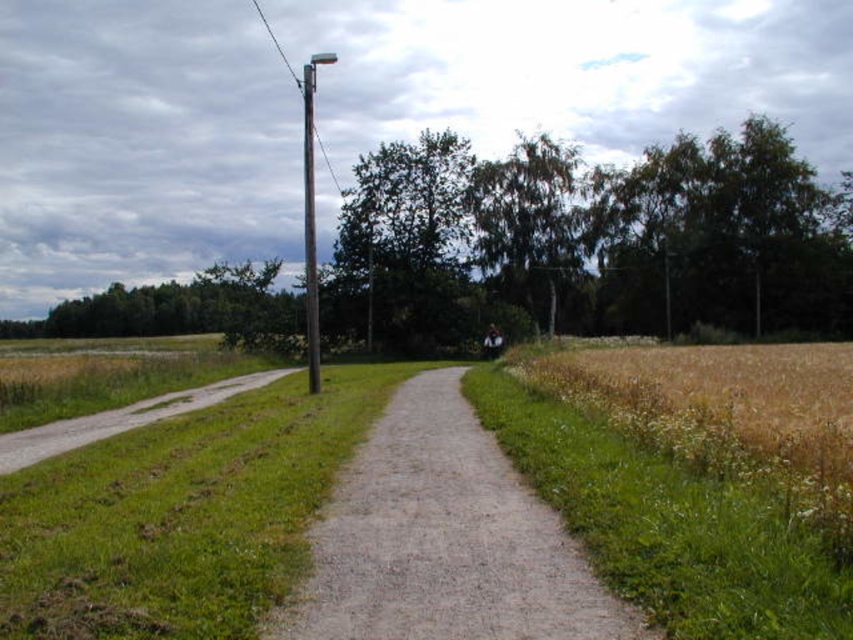
Question: Which object is the closest to the brown wooden telegraph pole at upper center?

Choices:
 (A) gravel path at lower left
 (B) gravel path at center
 (C) green grass at right
 (D) metallic pole at center

Answer: (D)

Question: Estimate the real-world distances between objects in this image. Which object is closer to the metallic pole at center?

Choices:
 (A) gravel path at lower left
 (B) gravel path at center
 (C) green grass at right

Answer: (A)

Question: From the image, what is the correct spatial relationship of green grass at right in relation to gravel path at lower left?

Choices:
 (A) left
 (B) right

Answer: (B)

Question: Estimate the real-world distances between objects in this image. Which object is closer to the gravel path at lower left?

Choices:
 (A) metallic pole at center
 (B) brown wooden telegraph pole at upper center
 (C) gravel path at center

Answer: (C)

Question: Is green grass at right bigger than gravel path at lower left?

Choices:
 (A) no
 (B) yes

Answer: (A)

Question: Is brown wooden telegraph pole at upper center wider than metallic pole at center?

Choices:
 (A) yes
 (B) no

Answer: (B)